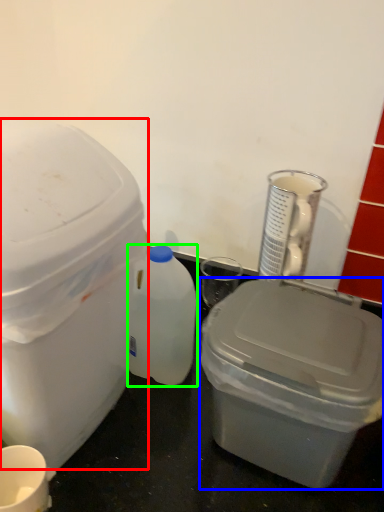
Question: Which is farther away from storage box (highlighted by a red box)? storage box (highlighted by a blue box) or bottle (highlighted by a green box)?

Choices:
 (A) storage box
 (B) bottle

Answer: (A)